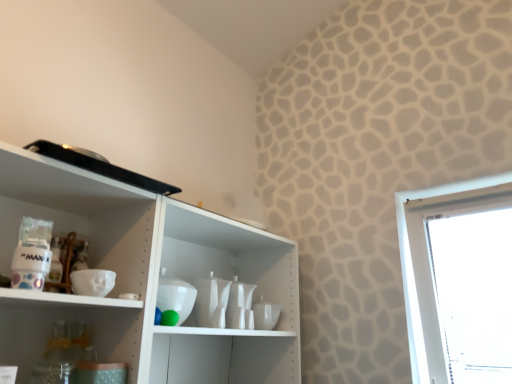
Describe the element at coordinates (265, 314) in the screenshot. I see `white glossy cup at center, the second tableware viewed from the left` at that location.

This screenshot has height=384, width=512. I want to click on white glossy cup at center, the first tableware viewed from the back, so click(265, 314).

Describe the element at coordinates (211, 301) in the screenshot. I see `white glossy vase at center, acting as the second tableware starting from the right` at that location.

Identify the location of white glossy vase at center, acting as the 1th tableware starting from the front. The height and width of the screenshot is (384, 512). (211, 301).

The height and width of the screenshot is (384, 512). I want to click on white glossy cup at center, the second tableware viewed from the left, so click(265, 314).

Which is more to the left, white glossy vase at center, acting as the 1th tableware starting from the front, or white glossy cup at center, the 2th tableware in the front-to-back sequence?

white glossy vase at center, acting as the 1th tableware starting from the front.

Which object is closer to the camera taking this photo, white glossy vase at center, acting as the 1th tableware starting from the front, or white glossy cup at center, the second tableware viewed from the left?

white glossy vase at center, acting as the 1th tableware starting from the front, is more forward.

Which is nearer, (x=195, y=318) or (x=273, y=327)?

Point (x=195, y=318) appears to be closer to the viewer than point (x=273, y=327).

From the image's perspective, relative to white glossy cup at center, the 2th tableware in the front-to-back sequence, is white glossy vase at center, acting as the 1th tableware starting from the front, above or below?

Based on their image positions, white glossy vase at center, acting as the 1th tableware starting from the front, is located above white glossy cup at center, the 2th tableware in the front-to-back sequence.

From a real-world perspective, between white glossy vase at center, marked as the first tableware in a left-to-right arrangement, and white glossy cup at center, which is the 1th tableware from right to left, who is vertically higher?

In real-world perspective, white glossy vase at center, marked as the first tableware in a left-to-right arrangement, is above.

Considering the relative sizes of white glossy vase at center, marked as the first tableware in a left-to-right arrangement, and white glossy cup at center, the second tableware viewed from the left, in the image provided, is white glossy vase at center, marked as the first tableware in a left-to-right arrangement, thinner than white glossy cup at center, the second tableware viewed from the left,?

No.

Does white glossy vase at center, acting as the second tableware starting from the right, have a lesser height compared to white glossy cup at center, which is the 1th tableware from right to left?

No.

Considering the relative sizes of white glossy vase at center, acting as the second tableware starting from the right, and white glossy cup at center, which is the 1th tableware from right to left, in the image provided, is white glossy vase at center, acting as the second tableware starting from the right, bigger than white glossy cup at center, which is the 1th tableware from right to left,?

Yes.

Is white glossy vase at center, acting as the second tableware starting from the right, not inside white glossy cup at center, the first tableware viewed from the back?

white glossy vase at center, acting as the second tableware starting from the right, is positioned outside white glossy cup at center, the first tableware viewed from the back.

Is white glossy vase at center, acting as the second tableware starting from the right, in contact with white glossy cup at center, the second tableware viewed from the left?

They are not placed beside each other.

Is white glossy cup at center, the first tableware viewed from the back, at the back of white glossy vase at center, marked as the first tableware in a left-to-right arrangement?

No, white glossy vase at center, marked as the first tableware in a left-to-right arrangement, is not facing away from white glossy cup at center, the first tableware viewed from the back.

Where is `tableware located on the right of white glossy vase at center, marked as the first tableware in a left-to-right arrangement`? Image resolution: width=512 pixels, height=384 pixels. tableware located on the right of white glossy vase at center, marked as the first tableware in a left-to-right arrangement is located at coordinates pos(265,314).

In the image, is white glossy cup at center, which is the 1th tableware from right to left, on the left side or the right side of white glossy vase at center, acting as the second tableware starting from the right?

white glossy cup at center, which is the 1th tableware from right to left, is to the right of white glossy vase at center, acting as the second tableware starting from the right.

Does white glossy cup at center, the second tableware viewed from the left, come behind white glossy vase at center, marked as the first tableware in a left-to-right arrangement?

Yes, it is behind white glossy vase at center, marked as the first tableware in a left-to-right arrangement.

Based on the photo, which is more distant, (256, 324) or (220, 327)?

The point (256, 324) is farther from the camera.

From the image's perspective, is white glossy cup at center, the first tableware viewed from the back, located beneath white glossy vase at center, acting as the 1th tableware starting from the front?

Yes.

From a real-world perspective, which is physically above, white glossy cup at center, which is the 1th tableware from right to left, or white glossy vase at center, acting as the second tableware starting from the right?

white glossy vase at center, acting as the second tableware starting from the right, from a real-world perspective.

Can you confirm if white glossy cup at center, the 2th tableware in the front-to-back sequence, is wider than white glossy vase at center, acting as the second tableware starting from the right?

In fact, white glossy cup at center, the 2th tableware in the front-to-back sequence, might be narrower than white glossy vase at center, acting as the second tableware starting from the right.

Who is taller, white glossy cup at center, which is the 1th tableware from right to left, or white glossy vase at center, which is the second tableware from back to front?

Standing taller between the two is white glossy vase at center, which is the second tableware from back to front.

Looking at the image, does white glossy cup at center, the 2th tableware in the front-to-back sequence, seem bigger or smaller compared to white glossy vase at center, acting as the second tableware starting from the right?

In the image, white glossy cup at center, the 2th tableware in the front-to-back sequence, appears to be smaller than white glossy vase at center, acting as the second tableware starting from the right.

Is white glossy vase at center, which is the second tableware from back to front, inside white glossy cup at center, the 2th tableware in the front-to-back sequence?

No, white glossy vase at center, which is the second tableware from back to front, is not inside white glossy cup at center, the 2th tableware in the front-to-back sequence.

Is white glossy cup at center, which is the 1th tableware from right to left, far away from white glossy vase at center, marked as the first tableware in a left-to-right arrangement?

That's not correct — white glossy cup at center, which is the 1th tableware from right to left, is a little close to white glossy vase at center, marked as the first tableware in a left-to-right arrangement.

Could you tell me if white glossy cup at center, which is the 1th tableware from right to left, is facing white glossy vase at center, acting as the 1th tableware starting from the front?

No, white glossy cup at center, which is the 1th tableware from right to left, is not aimed at white glossy vase at center, acting as the 1th tableware starting from the front.

The image size is (512, 384). I want to click on tableware above the white glossy cup at center, the second tableware viewed from the left (from the image's perspective), so click(x=211, y=301).

The width and height of the screenshot is (512, 384). In order to click on tableware that appears below the white glossy vase at center, which is the second tableware from back to front (from a real-world perspective) in this screenshot , I will do `click(265, 314)`.

Locate an element on the screen. tableware located above the white glossy cup at center, the first tableware viewed from the back (from a real-world perspective) is located at coordinates (211, 301).